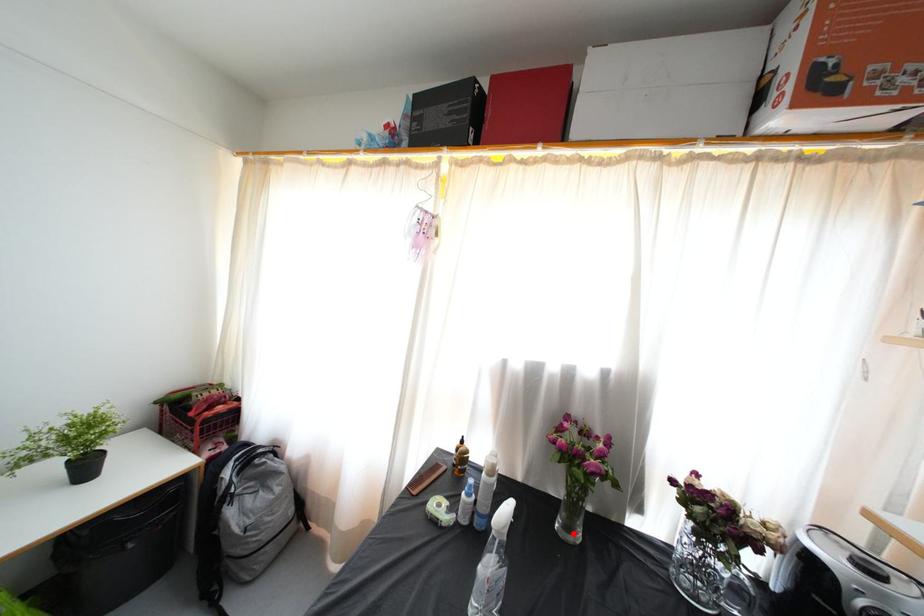
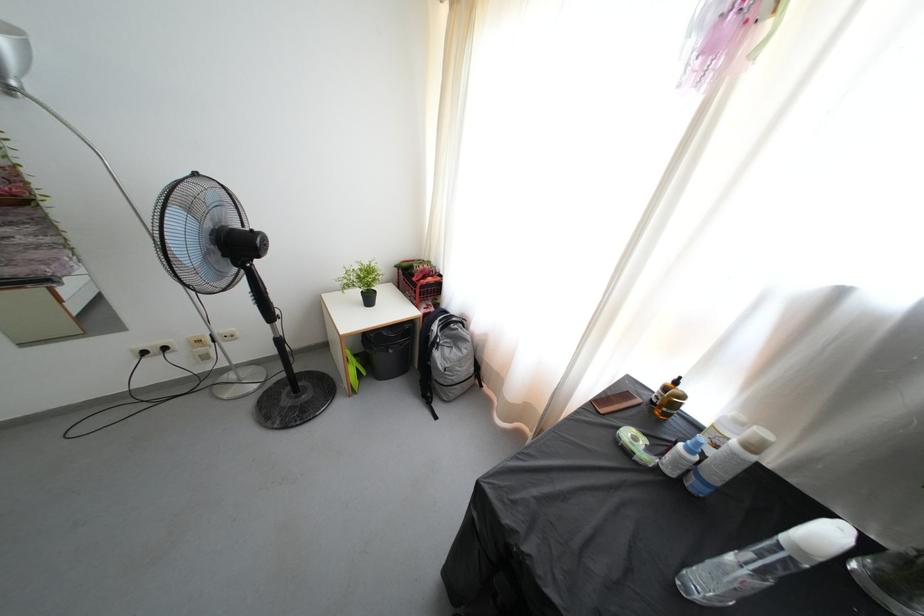
Where in the second image is the point corresponding to the highlighted location from the first image?

(894, 592)